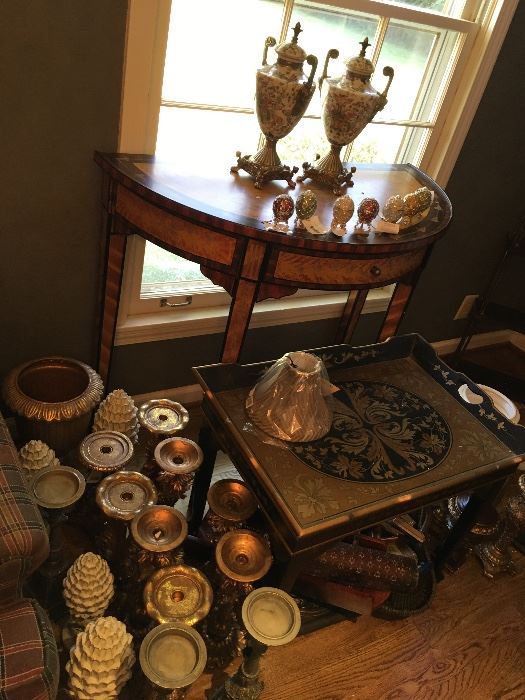
You are a GUI agent. You are given a task and a screenshot of the screen. Output one action in this format:
    pyautogui.click(x=<x>, y=<y>)
    Task: Click on the candle holder
    
    Given the screenshot: What is the action you would take?
    pyautogui.click(x=159, y=540)